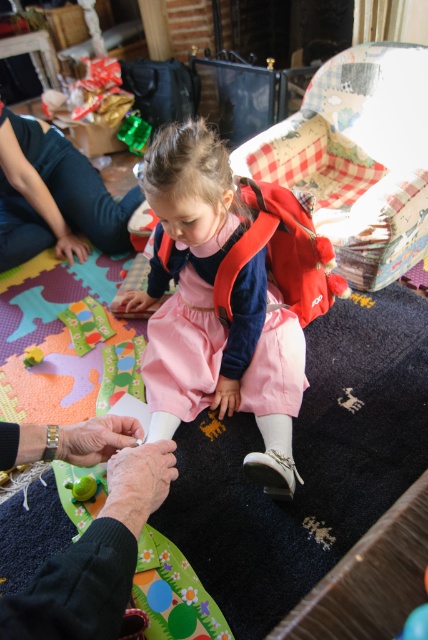
Question: Does pink satin dress at center appear under dark green fabric at upper left?

Choices:
 (A) no
 (B) yes

Answer: (B)

Question: Among these objects, which one is farthest from the camera?

Choices:
 (A) dark green fabric at upper left
 (B) green matte toy at lower left

Answer: (A)

Question: Observing the image, what is the correct spatial positioning of pink satin dress at center in reference to green matte toy at lower left?

Choices:
 (A) above
 (B) below

Answer: (A)

Question: Which of the following is the farthest from the observer?

Choices:
 (A) pink satin dress at center
 (B) dark green fabric at upper left

Answer: (B)

Question: Based on their relative distances, which object is nearer to the dark green fabric at upper left?

Choices:
 (A) pink satin dress at center
 (B) green matte toy at lower left

Answer: (A)

Question: Does pink satin dress at center appear under dark green fabric at upper left?

Choices:
 (A) no
 (B) yes

Answer: (B)